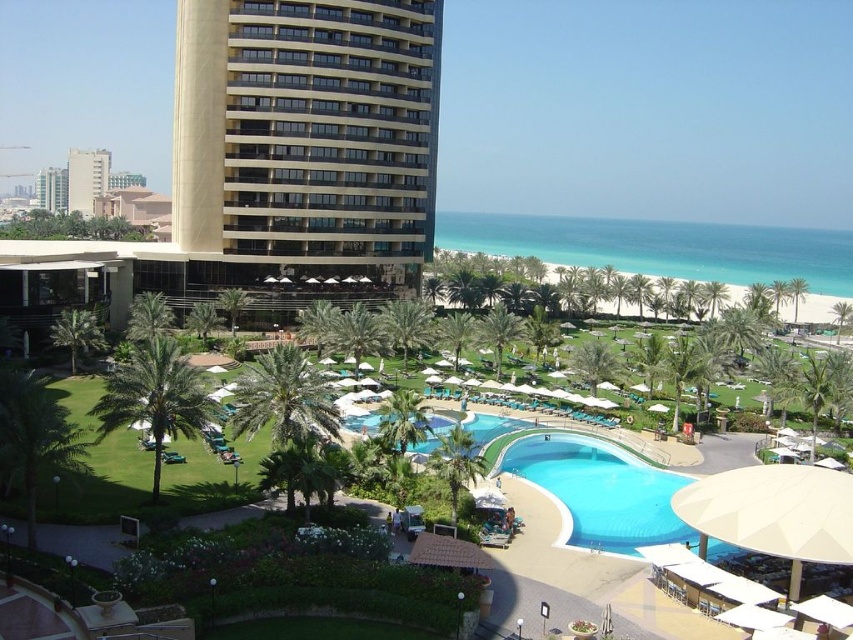
Question: Among these objects, which one is nearest to the camera?

Choices:
 (A) blue glossy pool at center
 (B) beige textured building at upper left

Answer: (A)

Question: Which object is farther from the camera taking this photo?

Choices:
 (A) beige textured building at upper left
 (B) blue glossy pool at center

Answer: (A)

Question: Which point is closer to the camera?

Choices:
 (A) (186, 160)
 (B) (585, 493)

Answer: (B)

Question: From the image, what is the correct spatial relationship of beige textured building at upper left in relation to blue glossy pool at center?

Choices:
 (A) below
 (B) above

Answer: (B)

Question: Considering the relative positions of beige textured building at upper left and blue glossy pool at center in the image provided, where is beige textured building at upper left located with respect to blue glossy pool at center?

Choices:
 (A) above
 (B) below

Answer: (A)

Question: Does beige textured building at upper left lie in front of blue glossy pool at center?

Choices:
 (A) yes
 (B) no

Answer: (B)